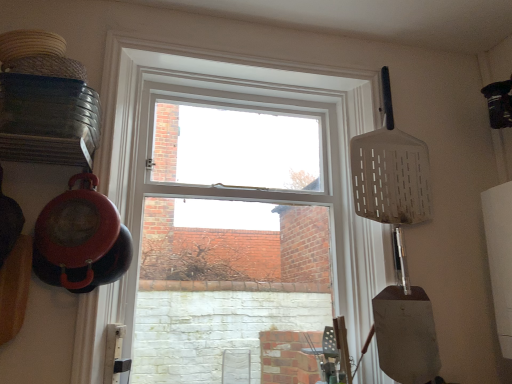
Question: Considering the relative sizes of clear glass window at center and white plastic spatula at upper right in the image provided, is clear glass window at center shorter than white plastic spatula at upper right?

Choices:
 (A) no
 (B) yes

Answer: (A)

Question: Does clear glass window at center have a lesser width compared to white plastic spatula at upper right?

Choices:
 (A) no
 (B) yes

Answer: (A)

Question: Could you tell me if clear glass window at center is turned towards white plastic spatula at upper right?

Choices:
 (A) no
 (B) yes

Answer: (A)

Question: Does clear glass window at center lie behind white plastic spatula at upper right?

Choices:
 (A) yes
 (B) no

Answer: (B)

Question: From a real-world perspective, is clear glass window at center on white plastic spatula at upper right?

Choices:
 (A) yes
 (B) no

Answer: (B)

Question: Considering the positions of white plastic spatula at upper right and metallic silver shovel at right in the image, is white plastic spatula at upper right bigger or smaller than metallic silver shovel at right?

Choices:
 (A) big
 (B) small

Answer: (A)

Question: Is white plastic spatula at upper right inside or outside of metallic silver shovel at right?

Choices:
 (A) outside
 (B) inside

Answer: (A)

Question: From the image's perspective, is white plastic spatula at upper right above or below metallic silver shovel at right?

Choices:
 (A) above
 (B) below

Answer: (A)

Question: From their relative heights in the image, would you say white plastic spatula at upper right is taller or shorter than metallic silver shovel at right?

Choices:
 (A) tall
 (B) short

Answer: (A)

Question: Considering the positions of point (278, 102) and point (428, 332), is point (278, 102) closer or farther from the camera than point (428, 332)?

Choices:
 (A) closer
 (B) farther

Answer: (B)

Question: Considering the positions of clear glass window at center and metallic silver shovel at right in the image, is clear glass window at center taller or shorter than metallic silver shovel at right?

Choices:
 (A) short
 (B) tall

Answer: (B)

Question: From the image's perspective, is clear glass window at center located above or below metallic silver shovel at right?

Choices:
 (A) below
 (B) above

Answer: (B)

Question: In terms of width, does clear glass window at center look wider or thinner when compared to metallic silver shovel at right?

Choices:
 (A) wide
 (B) thin

Answer: (A)

Question: Is metallic silver shovel at right in front of or behind white plastic spatula at upper right in the image?

Choices:
 (A) front
 (B) behind

Answer: (A)

Question: From the image's perspective, is metallic silver shovel at right located above or below white plastic spatula at upper right?

Choices:
 (A) below
 (B) above

Answer: (A)